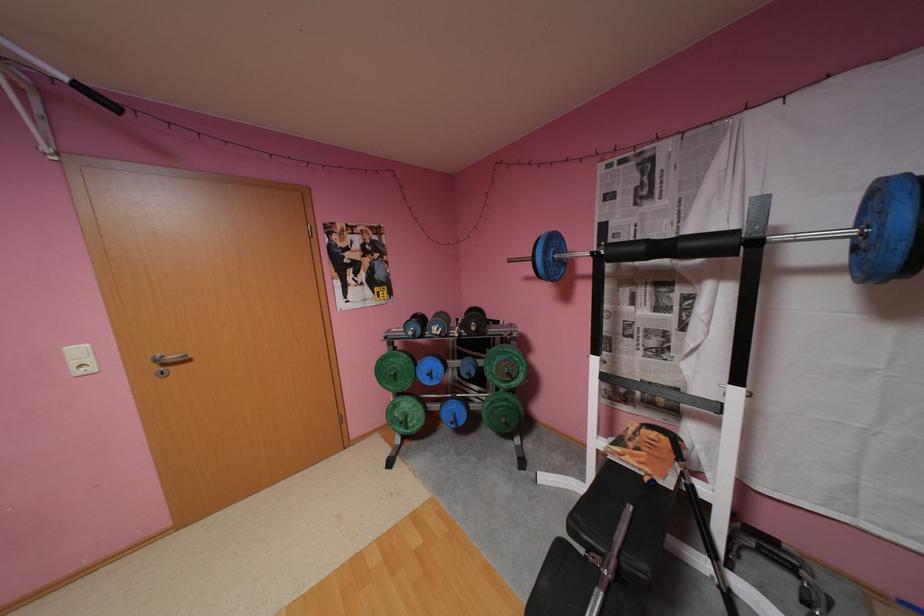
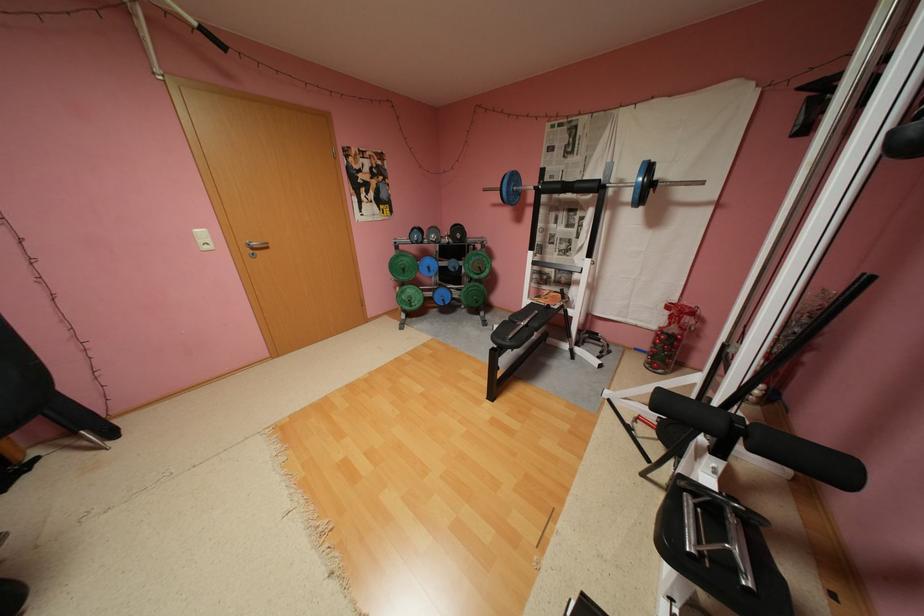
In the second image, find the point that corresponds to the point at 691,245 in the first image.

(586, 185)